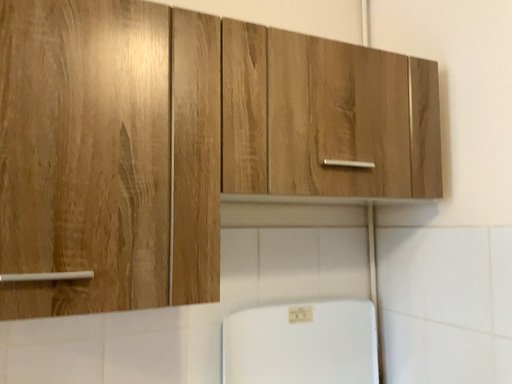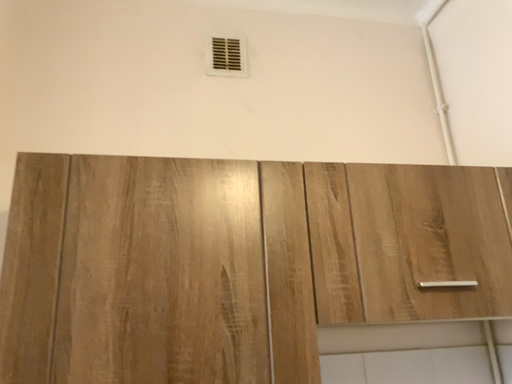
Question: Which way did the camera rotate in the video?

Choices:
 (A) rotated right
 (B) rotated left

Answer: (B)